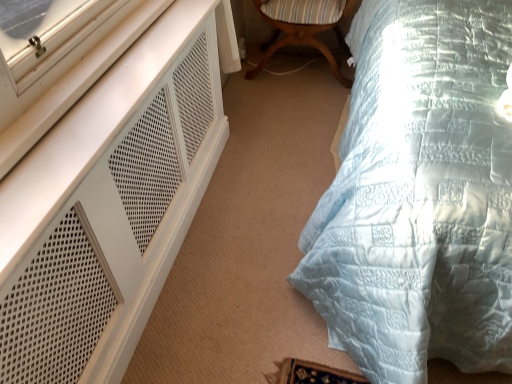
You are a GUI agent. You are given a task and a screenshot of the screen. Output one action in this format:
    pyautogui.click(x=<x>, y=<y>)
    Task: Click on the vacant space underneath wooden striped cushion at center (from a real-world perspective)
    Image resolution: width=512 pixels, height=384 pixels.
    Given the screenshot: What is the action you would take?
    pyautogui.click(x=294, y=69)